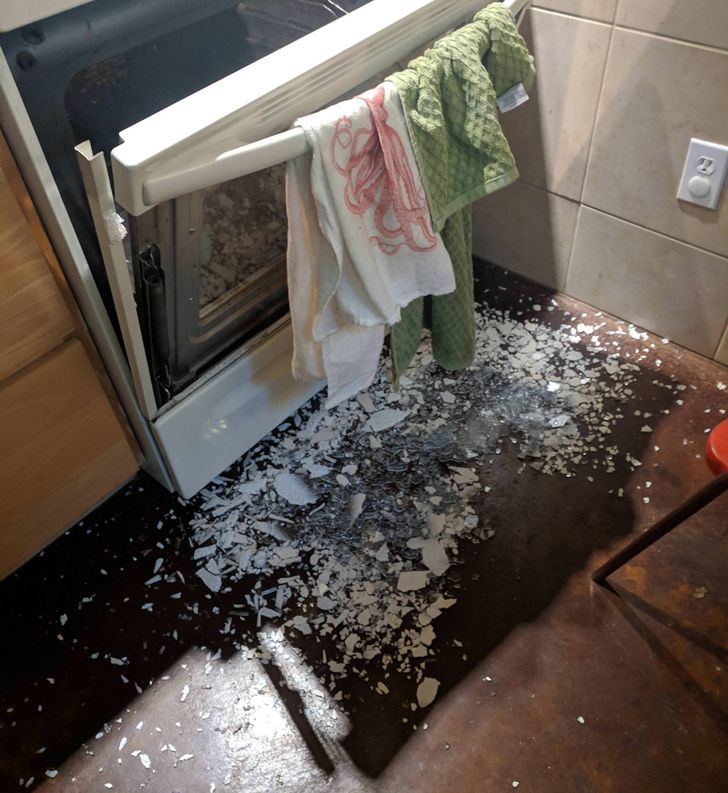
Where is `oven`? This screenshot has height=793, width=728. oven is located at coordinates (261, 156), (352, 102), (182, 32), (132, 60).